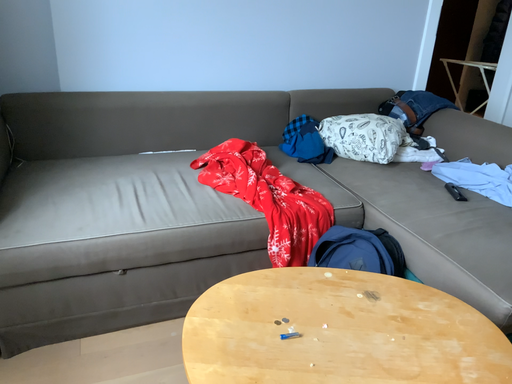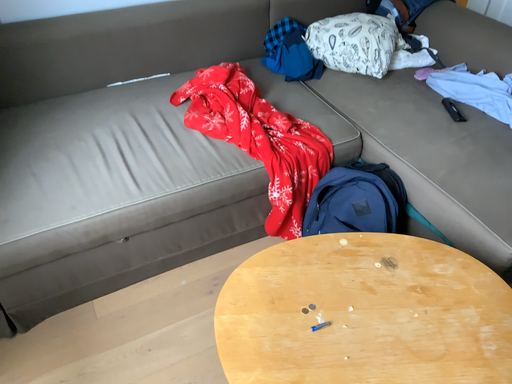
Question: Which way did the camera rotate in the video?

Choices:
 (A) rotated upward
 (B) rotated downward

Answer: (B)